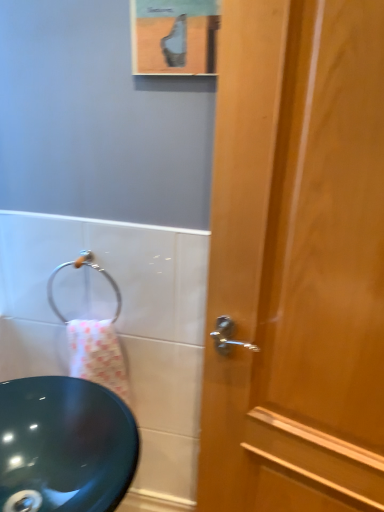
Question: Is wooden door at right in front of or behind silver metallic towel ring at lower left in the image?

Choices:
 (A) front
 (B) behind

Answer: (A)

Question: Based on their sizes in the image, would you say wooden door at right is bigger or smaller than silver metallic towel ring at lower left?

Choices:
 (A) big
 (B) small

Answer: (A)

Question: Which of these objects is positioned closest to the silver metallic towel ring at lower left?

Choices:
 (A) matte black sink at left
 (B) wooden door at right

Answer: (A)

Question: Which object is positioned closest to the matte black sink at left?

Choices:
 (A) silver metallic towel ring at lower left
 (B) wooden door at right

Answer: (A)